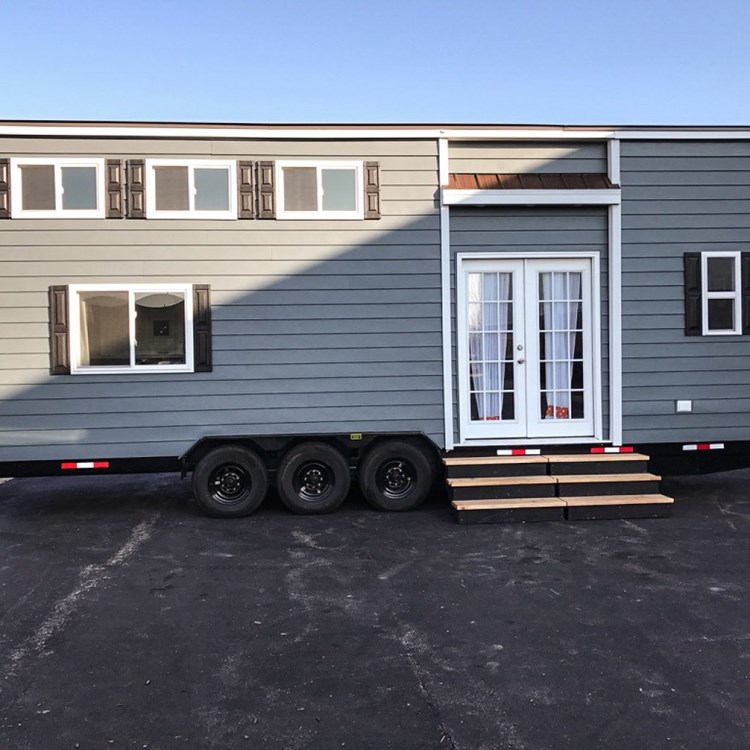
Locate an element on the screen. Image resolution: width=750 pixels, height=750 pixels. shutters is located at coordinates (202, 348), (60, 354), (122, 184), (4, 190), (260, 184), (370, 192), (693, 301).